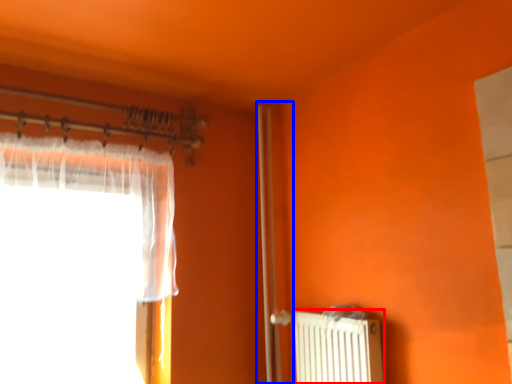
Question: Among these objects, which one is farthest to the camera, radiator (highlighted by a red box) or screen door (highlighted by a blue box)?

Choices:
 (A) radiator
 (B) screen door

Answer: (B)